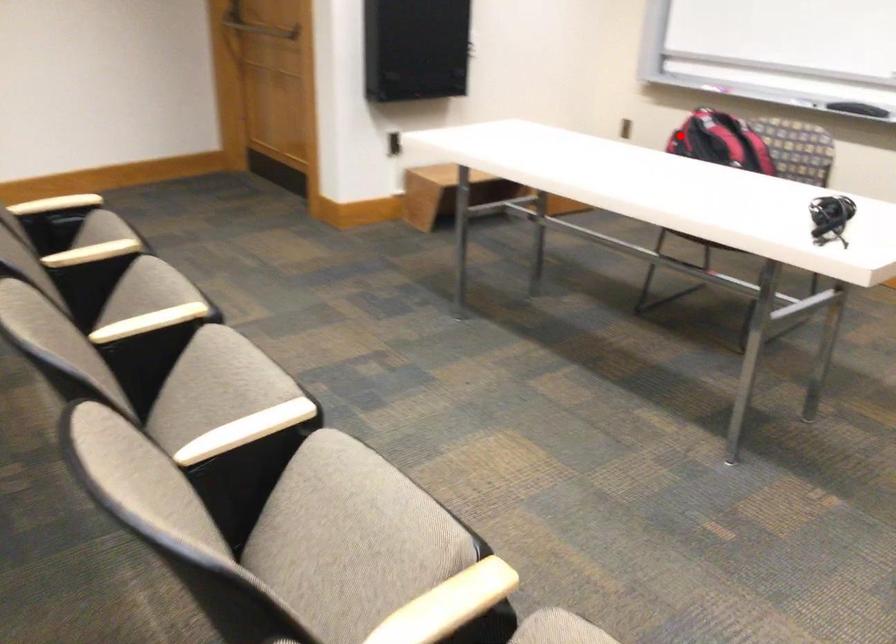
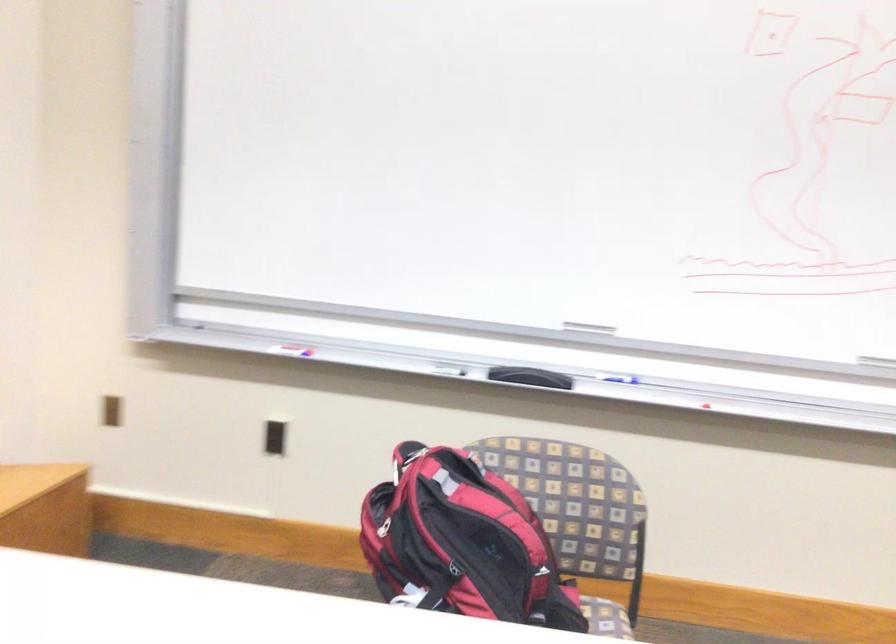
Question: A red point is marked in image1. In image2, is the corresponding 3D point closer to the camera or farther? Reply with the corresponding letter.

Choices:
 (A) The corresponding 3D point is closer.
 (B) The corresponding 3D point is farther.

Answer: (A)